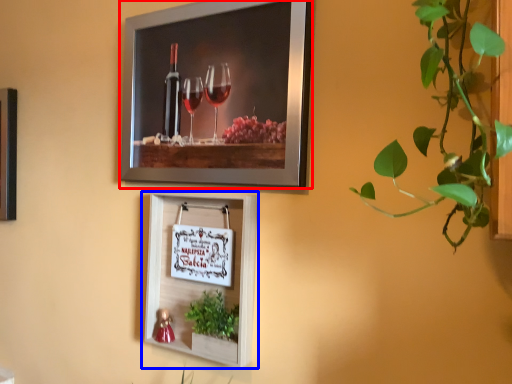
Question: Among these objects, which one is farthest to the camera, picture frame (highlighted by a red box) or picture frame (highlighted by a blue box)?

Choices:
 (A) picture frame
 (B) picture frame

Answer: (B)